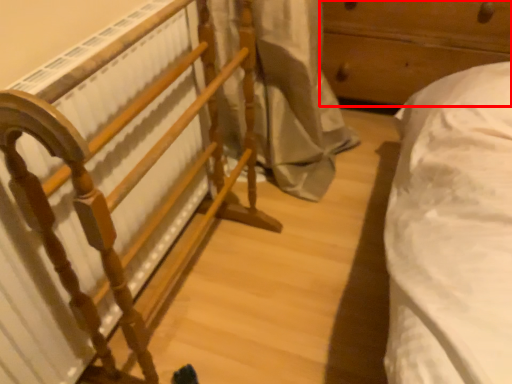
Question: From the image's perspective, where is furniture (annotated by the red box) located relative to furniture?

Choices:
 (A) below
 (B) above

Answer: (B)